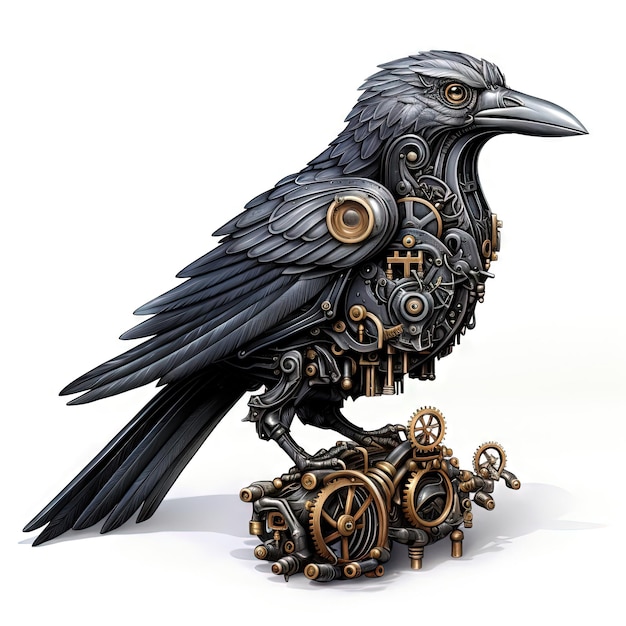
Identify the location of object shadow. tap(175, 515), tap(508, 516).